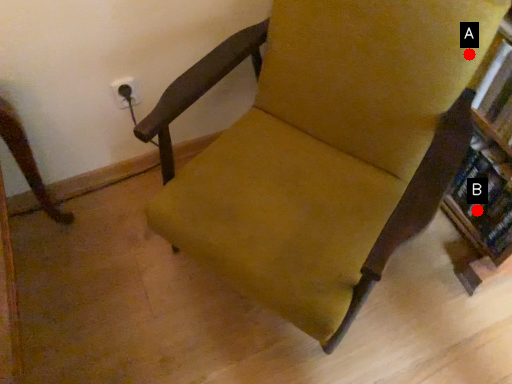
Question: Two points are circled on the image, labeled by A and B beside each circle. Which point is further to the camera?

Choices:
 (A) A is further
 (B) B is further

Answer: (B)